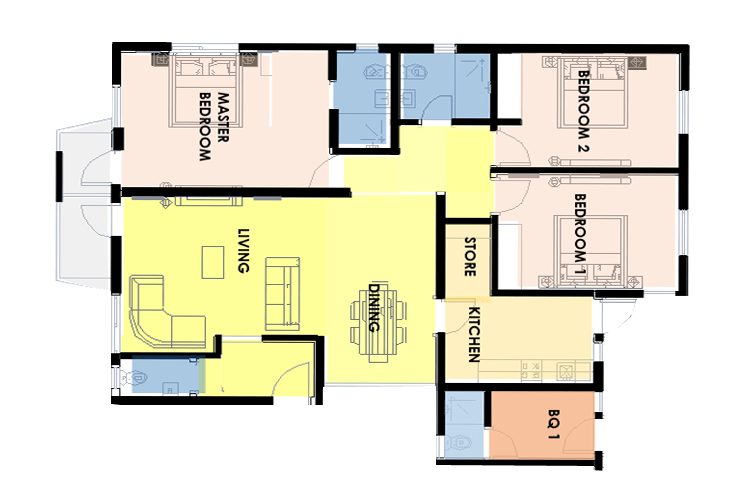
Image resolution: width=750 pixels, height=500 pixels. I want to click on dining table, so click(368, 327).